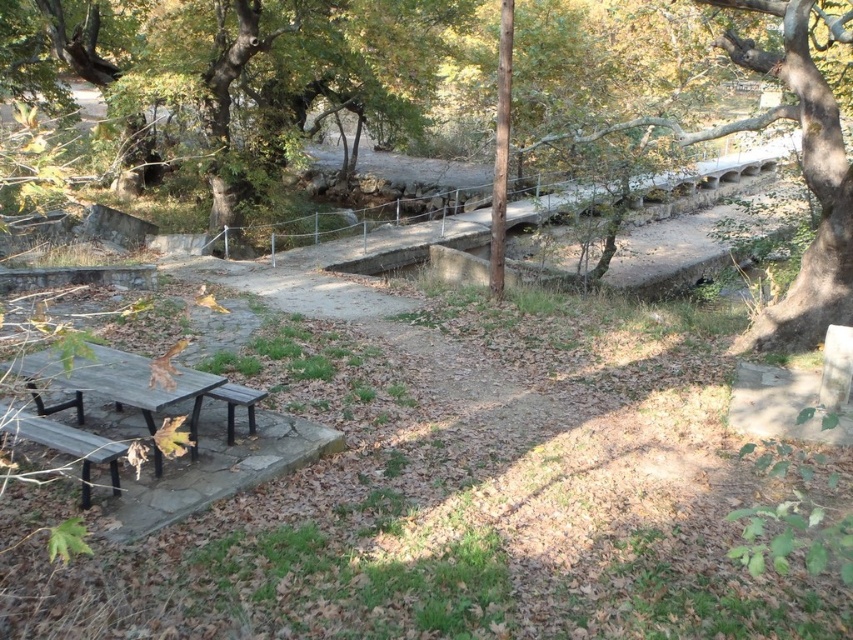
Question: Is smooth bark tree at upper right positioned behind dark brown wooden bench at center?

Choices:
 (A) yes
 (B) no

Answer: (A)

Question: Can you confirm if green leafy tree at upper left is wider than smooth bark tree at upper right?

Choices:
 (A) no
 (B) yes

Answer: (B)

Question: Among these objects, which one is nearest to the camera?

Choices:
 (A) dark brown wooden bench at center
 (B) wooden picnic table at lower left

Answer: (B)

Question: Which of the following is the closest to the observer?

Choices:
 (A) (293, 22)
 (B) (756, 54)
 (C) (199, 380)

Answer: (C)

Question: Which object appears closest to the camera in this image?

Choices:
 (A) green leafy tree at upper left
 (B) wooden park bench at lower left

Answer: (B)

Question: Is smooth bark tree at upper right to the left of wooden park bench at lower left from the viewer's perspective?

Choices:
 (A) no
 (B) yes

Answer: (A)